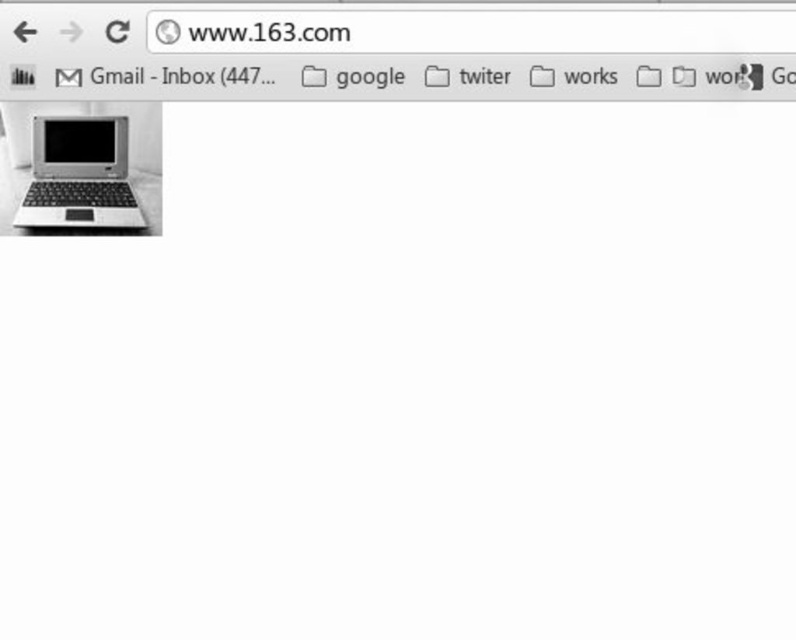
Question: Which of the following is the farthest from the observer?

Choices:
 (A) matte black screen at center
 (B) matte black laptop at left

Answer: (A)

Question: Does matte black laptop at left have a greater width compared to matte black screen at center?

Choices:
 (A) yes
 (B) no

Answer: (A)

Question: Is matte black laptop at left bigger than matte black screen at center?

Choices:
 (A) no
 (B) yes

Answer: (B)

Question: Which point appears closest to the camera in this image?

Choices:
 (A) 104,145
 (B) 61,186

Answer: (B)

Question: Which point is closer to the camera?

Choices:
 (A) (77, 148)
 (B) (32, 157)

Answer: (A)

Question: Is matte black laptop at left wider than matte black screen at center?

Choices:
 (A) no
 (B) yes

Answer: (B)